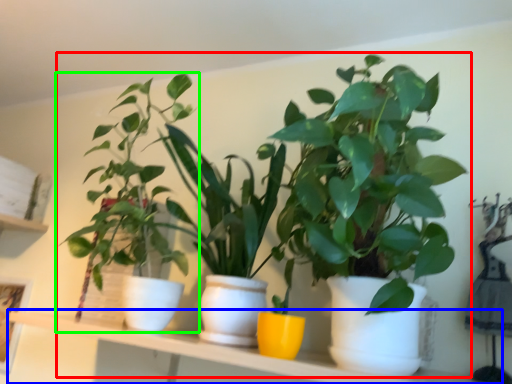
Question: Based on their relative distances, which object is farther from houseplant (highlighted by a red box)? Choose from window sill (highlighted by a blue box) and houseplant (highlighted by a green box).

Choices:
 (A) window sill
 (B) houseplant

Answer: (A)